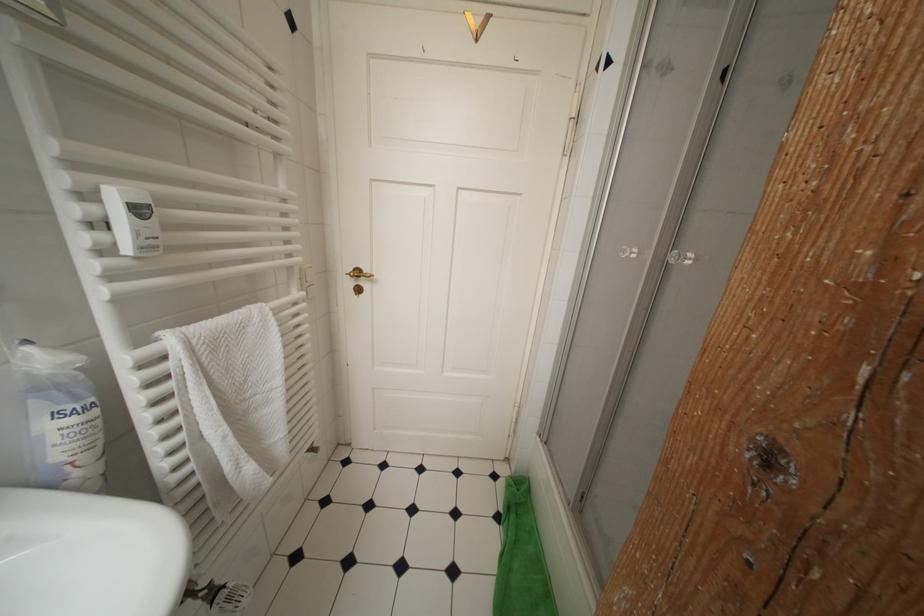
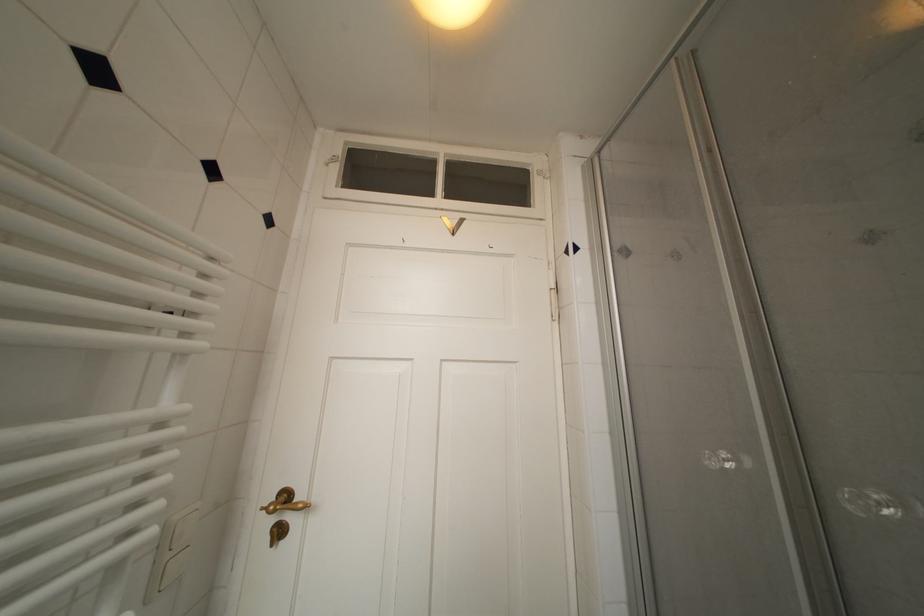
In the second image, find the point that corresponds to point (365, 276) in the first image.

(293, 500)